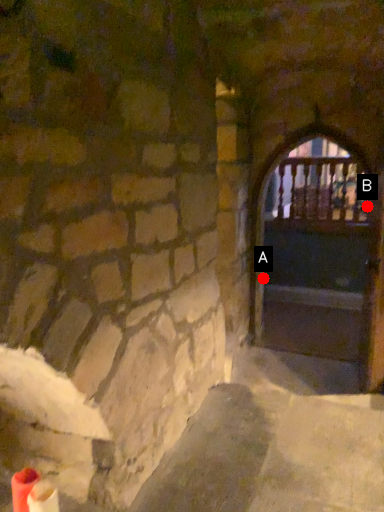
Question: Two points are circled on the image, labeled by A and B beside each circle. Which point is closer to the camera?

Choices:
 (A) A is closer
 (B) B is closer

Answer: (A)